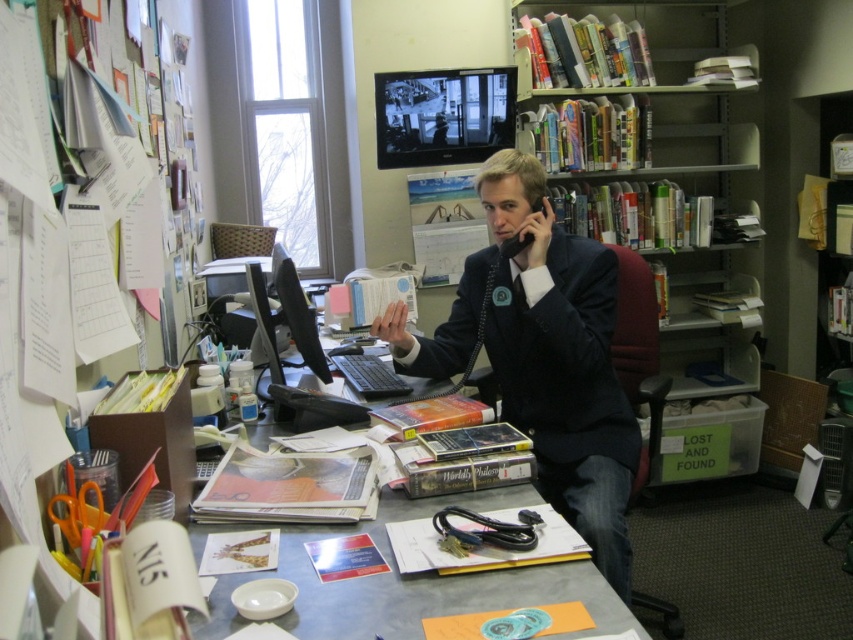
Between hardcover books at upper right and metallic gray desk at center, which one has more height?

With more height is hardcover books at upper right.

Can you confirm if hardcover books at upper right is taller than metallic gray desk at center?

Yes.

Who is more distant from viewer, (614, 100) or (198, 541)?

The point (614, 100) is more distant.

Locate an element on the screen. The image size is (853, 640). hardcover books at upper right is located at coordinates (663, 220).

In the scene shown: Does hardcover books at upper right appear on the left side of black suit at center?

No, hardcover books at upper right is not to the left of black suit at center.

Is point (643, 285) farther from viewer compared to point (538, 179)?

Yes, it is behind point (538, 179).

Identify the location of hardcover books at upper right. The width and height of the screenshot is (853, 640). (663, 220).

Is black suit at center to the left of metallic gray desk at center from the viewer's perspective?

No, black suit at center is not to the left of metallic gray desk at center.

Which is in front, point (479, 307) or point (625, 612)?

Point (625, 612) is in front.

Describe the element at coordinates (543, 355) in the screenshot. Image resolution: width=853 pixels, height=640 pixels. I see `black suit at center` at that location.

Where is `black suit at center`? The width and height of the screenshot is (853, 640). black suit at center is located at coordinates (543, 355).